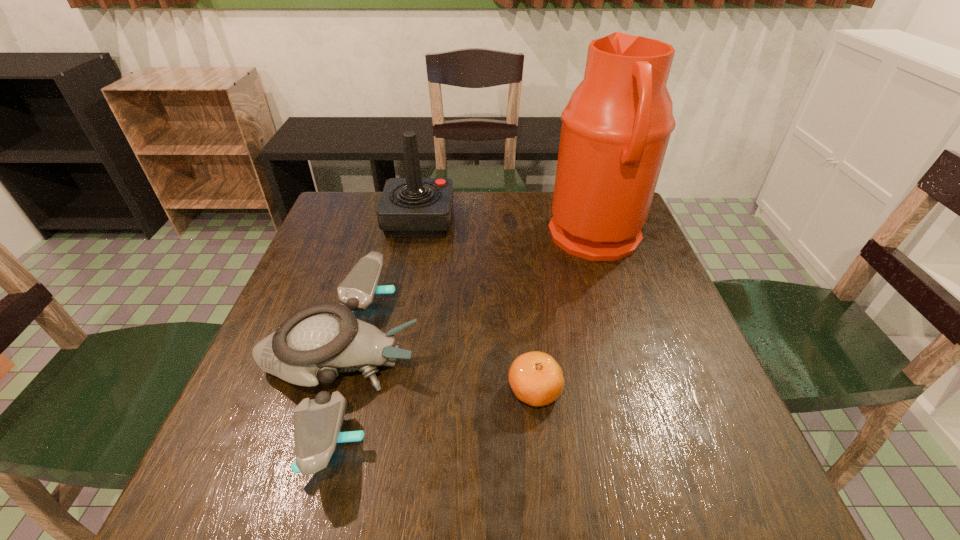
Find the location of a particular element. free space between the second shortest object and the second object from right to left is located at coordinates (437, 377).

Locate an element on the screen. This screenshot has height=540, width=960. vacant area that lies between the second tallest object and the water jug is located at coordinates (507, 230).

Locate an element on the screen. vacant area between the second shortest object and the water jug is located at coordinates (468, 301).

The height and width of the screenshot is (540, 960). I want to click on free point between the second object from right to left and the rightmost object, so click(564, 315).

The image size is (960, 540). Identify the location of object that can be found as the closest to the clementine. (316, 343).

Select which object appears as the second closest to the third tallest object. Please provide its 2D coordinates. Your answer should be formatted as a tuple, i.e. [(x, y)], where the tuple contains the x and y coordinates of a point satisfying the conditions above.

[(535, 377)]

Locate an element on the screen. This screenshot has height=540, width=960. free region that satisfies the following two spatial constraints: 1. from the spout of the rightmost object; 2. on the front side of the clementine is located at coordinates (647, 391).

Locate an element on the screen. vacant area that satisfies the following two spatial constraints: 1. on the front-facing side of the shortest object; 2. on the left side of the second shortest object is located at coordinates (331, 391).

This screenshot has height=540, width=960. Identify the location of free space in the image that satisfies the following two spatial constraints: 1. on the back side of the third object from left to right; 2. on the front-facing side of the third shortest object. coord(516,220).